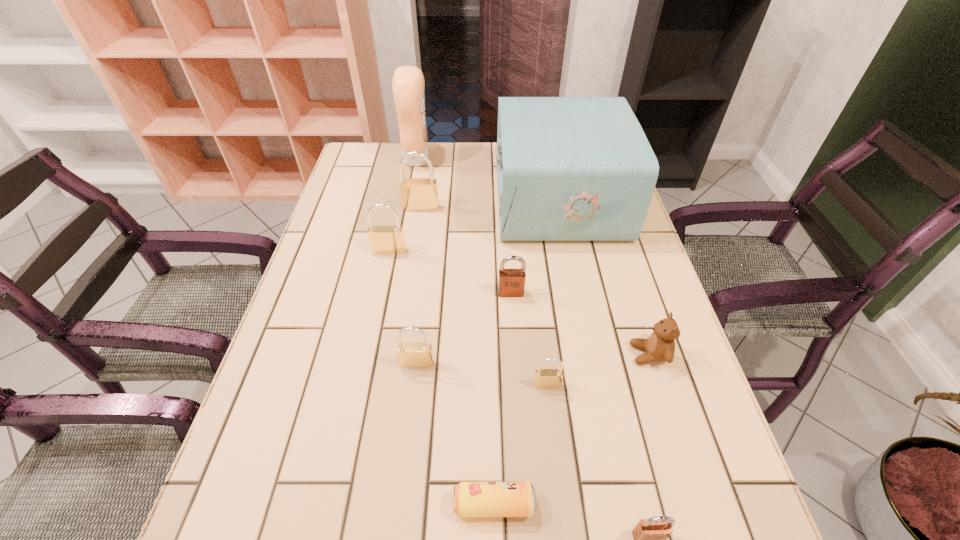
Locate an element on the screen. This screenshot has width=960, height=540. free space located 0.220m on the front-facing side of the third nearest brass padlock is located at coordinates (374, 322).

Find the location of `vacant space located 0.200m on the front-facing side of the farther brown padlock`. vacant space located 0.200m on the front-facing side of the farther brown padlock is located at coordinates (516, 372).

The height and width of the screenshot is (540, 960). Find the location of `blank space located on the front-facing side of the second smallest brass padlock`. blank space located on the front-facing side of the second smallest brass padlock is located at coordinates (402, 487).

Where is `free space located on the front-facing side of the teddy bear`? The image size is (960, 540). free space located on the front-facing side of the teddy bear is located at coordinates (449, 354).

Where is `vacant space located on the front-facing side of the teddy bear`? vacant space located on the front-facing side of the teddy bear is located at coordinates (588, 354).

Identify the location of vacant space positioned 0.060m on the front-facing side of the teddy bear. The image size is (960, 540). (603, 354).

You are a GUI agent. You are given a task and a screenshot of the screen. Output one action in this format:
    pyautogui.click(x=<x>, y=<y>)
    Task: Click on the vacant region located on the front-facing side of the eighth farthest object
    The width and height of the screenshot is (960, 540).
    Given the screenshot: What is the action you would take?
    pyautogui.click(x=559, y=484)

You are a GUI agent. You are given a task and a screenshot of the screen. Output one action in this format:
    pyautogui.click(x=<x>, y=<y>)
    Task: Click on the vacant space located on the right of the shortest object
    The image size is (960, 540).
    Given the screenshot: What is the action you would take?
    pyautogui.click(x=723, y=504)

I want to click on condiment located in the far edge section of the desktop, so click(408, 85).

Find the location of a particular element. This screenshot has height=540, width=960. radio receiver present at the far edge is located at coordinates (568, 168).